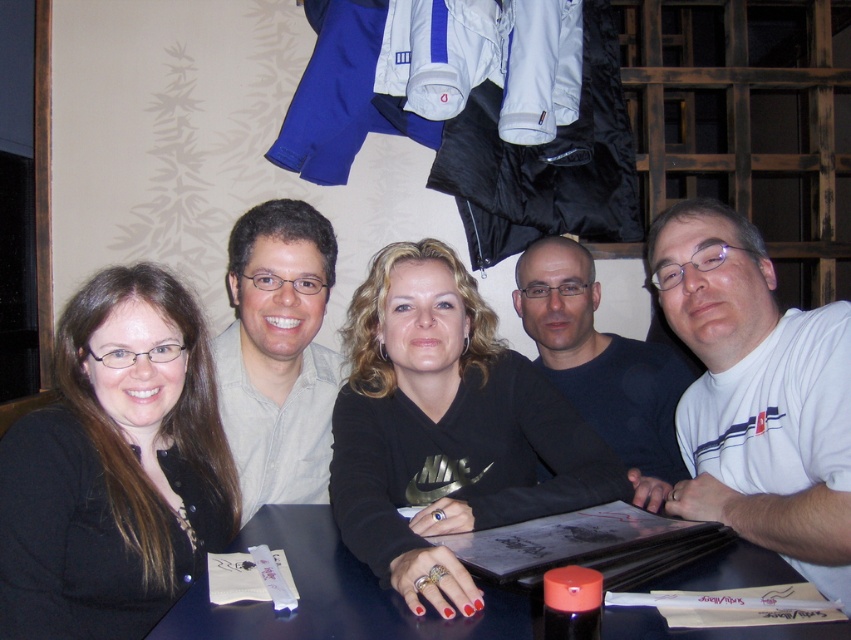
You are a photographer taking a picture of the group. You want to ensure that the black matte shirt at center is visible above the smooth dark wood table at center. Is this possible based on their current positions?

Yes, because the smooth dark wood table at center is located below the black matte shirt at center, so the shirt is above the table and visible.